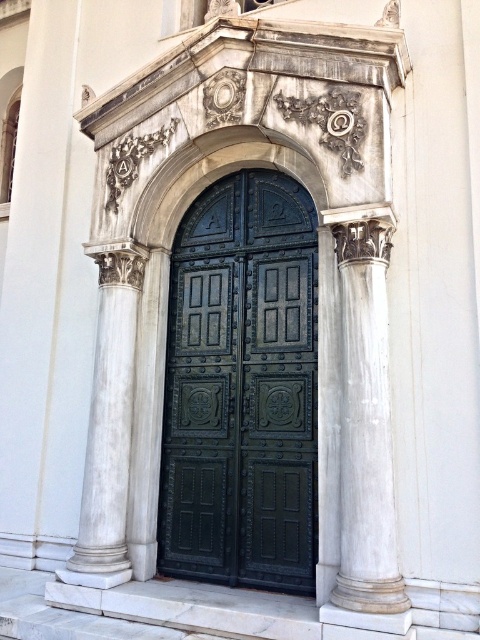
Can you confirm if white marble column at right is thinner than white marble column at left?

Yes, white marble column at right is thinner than white marble column at left.

Describe the element at coordinates (365, 417) in the screenshot. I see `white marble column at right` at that location.

You are a GUI agent. You are given a task and a screenshot of the screen. Output one action in this format:
    pyautogui.click(x=<x>, y=<y>)
    Task: Click on the white marble column at right
    
    Given the screenshot: What is the action you would take?
    pyautogui.click(x=365, y=417)

Can you confirm if green polished wood door at center is taller than white marble column at left?

Yes.

Is green polished wood door at center positioned behind white marble column at left?

No.

Which is behind, point (176, 340) or point (124, 548)?

The point (176, 340) is behind.

This screenshot has height=640, width=480. What are the coordinates of `green polished wood door at center` in the screenshot? It's located at (241, 388).

Can you confirm if green polished wood door at center is smaller than white marble column at right?

No, green polished wood door at center is not smaller than white marble column at right.

Between green polished wood door at center and white marble column at right, which one appears on the left side from the viewer's perspective?

green polished wood door at center

Does point (294, 369) come closer to viewer compared to point (379, 296)?

No.

Where is `green polished wood door at center`? The image size is (480, 640). green polished wood door at center is located at coordinates (241, 388).